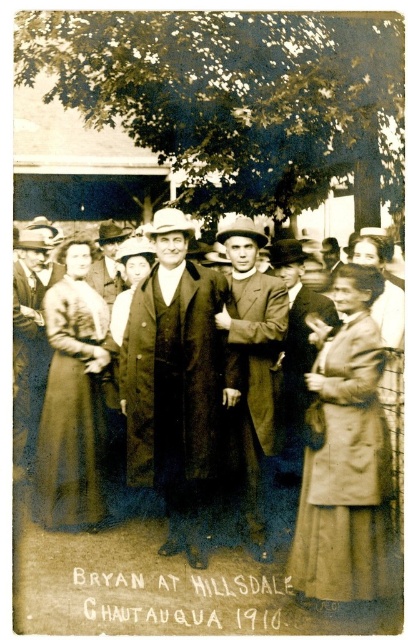
Question: Does matte black coat at left come behind dark brown suit at center?

Choices:
 (A) yes
 (B) no

Answer: (B)

Question: Among these points, which one is nearest to the camera?

Choices:
 (A) (104, 444)
 (B) (337, 529)
 (C) (113, 296)
 (D) (268, 326)

Answer: (B)

Question: Is dark brown wool coat at center to the right of smooth brown coat at center from the viewer's perspective?

Choices:
 (A) yes
 (B) no

Answer: (B)

Question: Which point is closer to the camera?

Choices:
 (A) (50, 509)
 (B) (270, 420)
 (C) (110, 228)

Answer: (B)

Question: Which point is farther from the camera taking this photo?

Choices:
 (A) [x=184, y=387]
 (B) [x=68, y=484]

Answer: (B)

Question: Does dark brown wool coat at center have a greater width compared to dark brown suit at center?

Choices:
 (A) yes
 (B) no

Answer: (A)